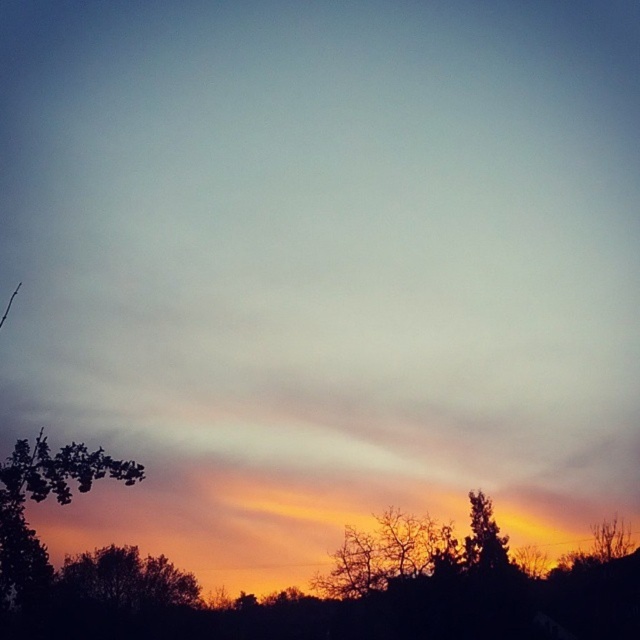
Question: Where is green leafy tree at lower left located in relation to silhouette tree at lower right in the image?

Choices:
 (A) left
 (B) right

Answer: (A)

Question: Which object is closer to the camera taking this photo?

Choices:
 (A) silhouette bare tree at lower center
 (B) green leafy tree at lower left

Answer: (B)

Question: Does silhouette bare tree at lower center have a larger size compared to silhouette tree at lower right?

Choices:
 (A) no
 (B) yes

Answer: (B)

Question: Which of the following is the closest to the observer?

Choices:
 (A) (452, 540)
 (B) (499, 536)

Answer: (A)

Question: From the image, what is the correct spatial relationship of silhouette bare tree at lower center in relation to silhouette tree at lower right?

Choices:
 (A) left
 (B) right

Answer: (A)

Question: Which point is closer to the camera?

Choices:
 (A) (20, 474)
 (B) (385, 573)

Answer: (A)